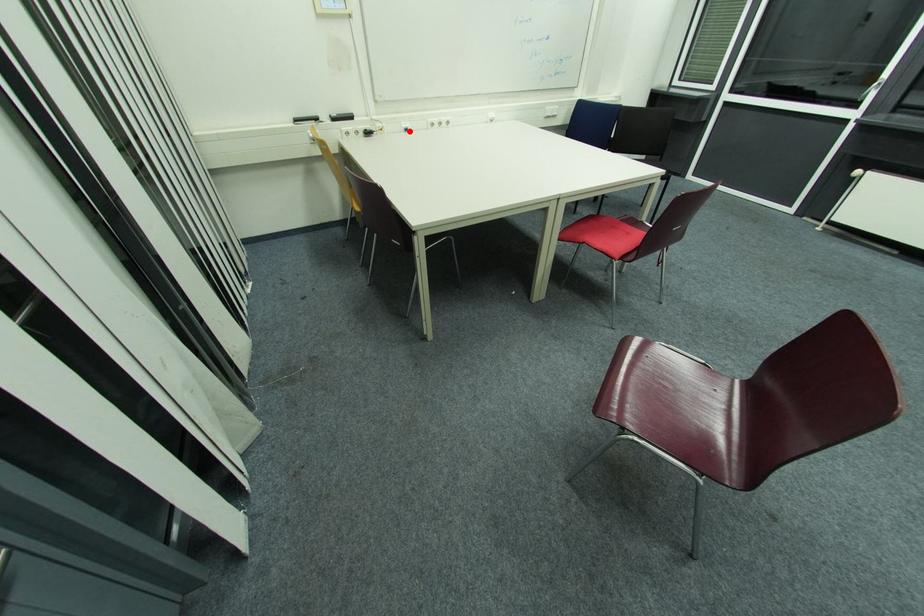
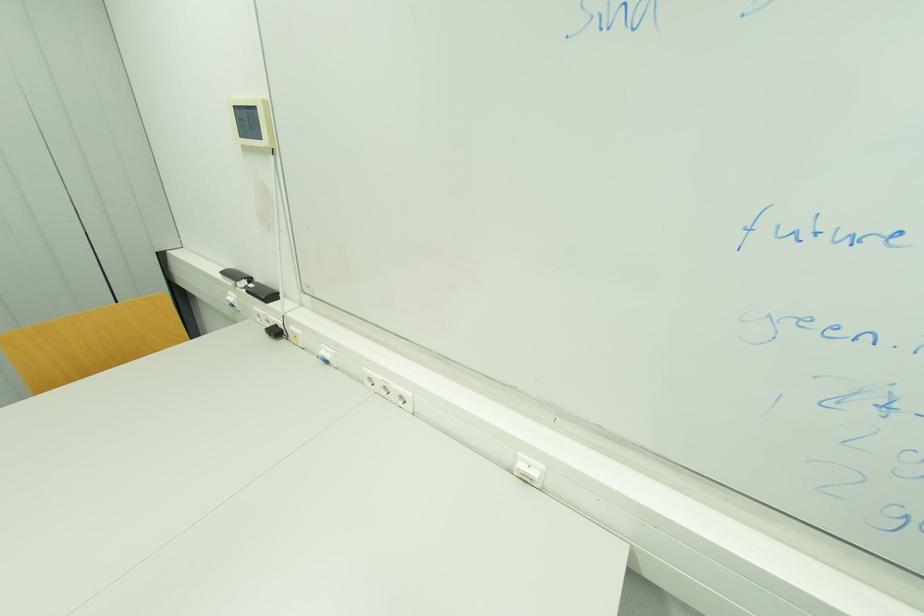
The point at the highlighted location is marked in the first image. Where is the corresponding point in the second image?

(330, 362)